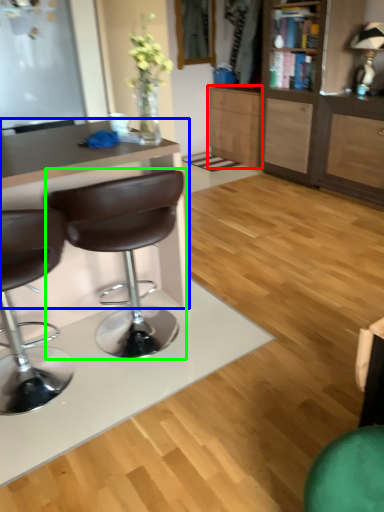
Question: Which is farther away from cabinetry (highlighted by a red box)? desk (highlighted by a blue box) or chair (highlighted by a green box)?

Choices:
 (A) desk
 (B) chair

Answer: (B)